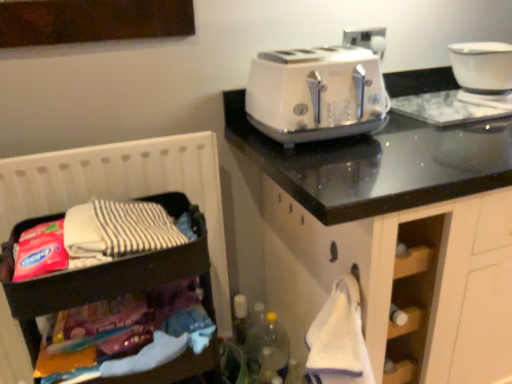
Question: Does wooden dark brown storage at left have a larger size compared to white glossy toaster at upper right?

Choices:
 (A) yes
 (B) no

Answer: (A)

Question: Can you confirm if wooden dark brown storage at left is shorter than white glossy toaster at upper right?

Choices:
 (A) no
 (B) yes

Answer: (A)

Question: Is wooden dark brown storage at left smaller than white glossy toaster at upper right?

Choices:
 (A) yes
 (B) no

Answer: (B)

Question: From a real-world perspective, is wooden dark brown storage at left below white glossy toaster at upper right?

Choices:
 (A) no
 (B) yes

Answer: (B)

Question: Would you say wooden dark brown storage at left is a long distance from white glossy toaster at upper right?

Choices:
 (A) yes
 (B) no

Answer: (B)

Question: Is wooden dark brown storage at left at the right side of white glossy toaster at upper right?

Choices:
 (A) yes
 (B) no

Answer: (B)

Question: Considering the relative sizes of white glossy toaster at upper right and white glossy bowl at upper right in the image provided, is white glossy toaster at upper right bigger than white glossy bowl at upper right?

Choices:
 (A) no
 (B) yes

Answer: (B)

Question: Are white glossy toaster at upper right and white glossy bowl at upper right beside each other?

Choices:
 (A) no
 (B) yes

Answer: (A)

Question: Is white glossy toaster at upper right positioned behind white glossy bowl at upper right?

Choices:
 (A) no
 (B) yes

Answer: (A)

Question: Does white glossy toaster at upper right lie in front of white glossy bowl at upper right?

Choices:
 (A) no
 (B) yes

Answer: (B)

Question: Is white glossy toaster at upper right oriented away from white glossy bowl at upper right?

Choices:
 (A) no
 (B) yes

Answer: (A)

Question: Is white glossy toaster at upper right taller than white glossy bowl at upper right?

Choices:
 (A) yes
 (B) no

Answer: (A)

Question: Considering the relative sizes of white glossy toaster at upper right and wooden dark brown storage at left in the image provided, is white glossy toaster at upper right thinner than wooden dark brown storage at left?

Choices:
 (A) no
 (B) yes

Answer: (A)